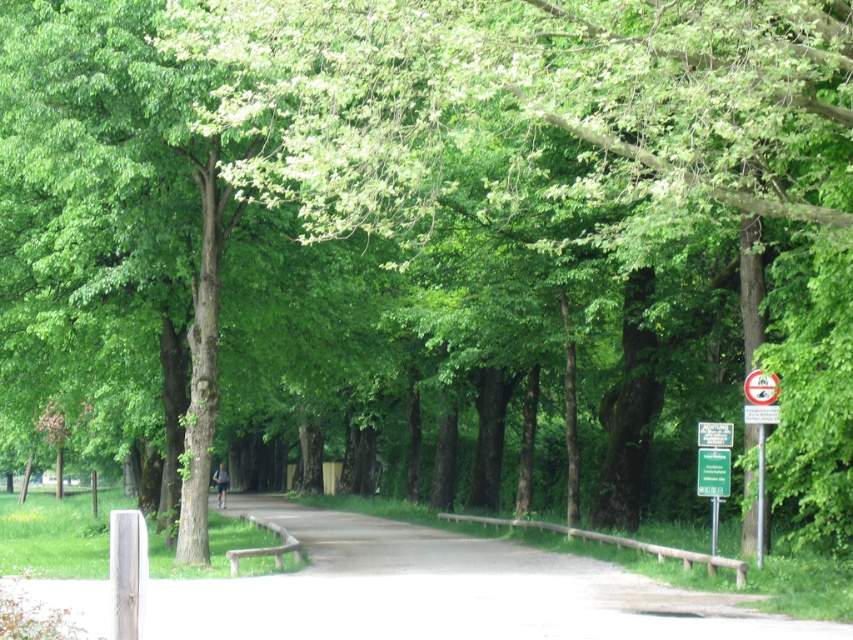
You are a gardener who needs to mow the lawn near the smooth asphalt path at center and the wooden bench at center. Which object is higher from the ground so you can avoid hitting it with your lawnmower?

The smooth asphalt path at center is much taller than the wooden bench at center, so you should avoid hitting the smooth asphalt path at center with your lawnmower.

You are a hiker walking along the smooth asphalt path at center and want to read the white plastic sign at upper right. Can you easily see the sign from your current position on the path?

The smooth asphalt path at center is below the white plastic sign at upper right, so yes, you can easily see the white plastic sign at upper right from your position on the path.